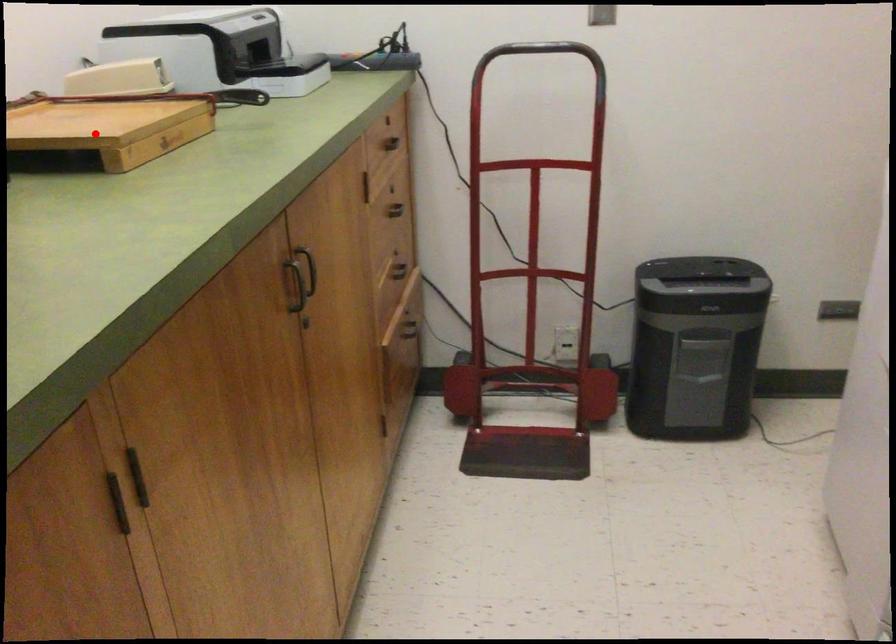
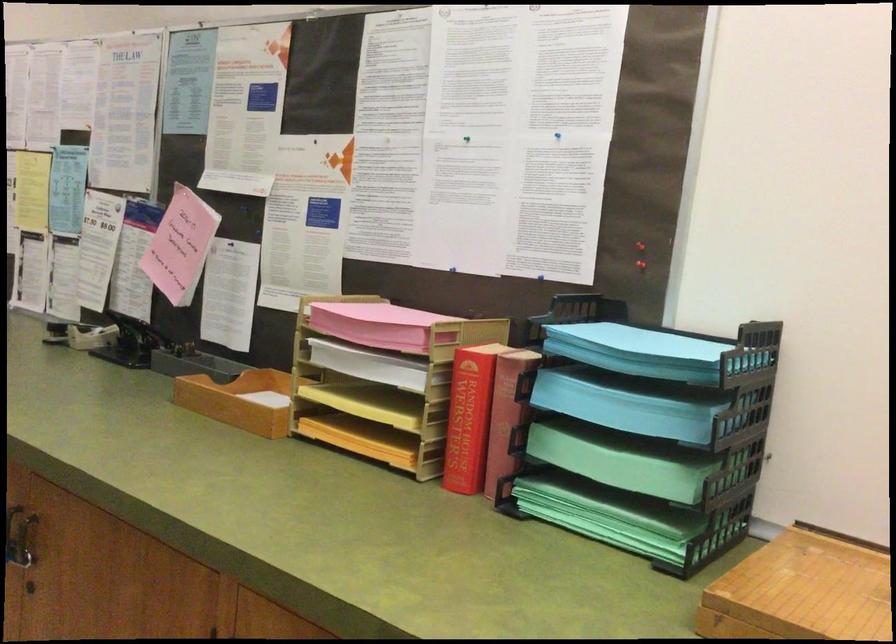
Question: A red point is marked in image1. In image2, is the corresponding 3D point closer to the camera or farther? Reply with the corresponding letter.

Choices:
 (A) The corresponding 3D point is closer.
 (B) The corresponding 3D point is farther.

Answer: (A)